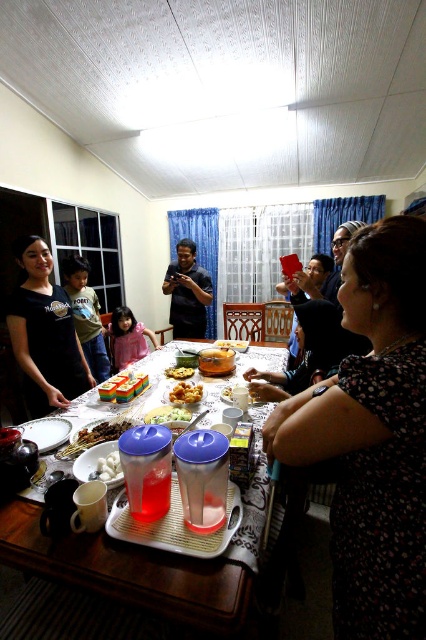
Does matte black shirt at left have a lesser width compared to matte black shirt at center?

Incorrect, matte black shirt at left's width is not less than matte black shirt at center's.

Who is shorter, matte black shirt at left or matte black shirt at center?

Standing shorter between the two is matte black shirt at center.

Is point (25, 260) more distant than point (181, 316)?

No, it is in front of (181, 316).

Where is `matte black shirt at left`? matte black shirt at left is located at coordinates (45, 333).

Which is below, white glossy platter at center or green leafy salad at center?

white glossy platter at center is lower down.

Measure the distance from white glossy platter at center to green leafy salad at center.

12.41 inches

Is point (37, 419) more distant than point (166, 416)?

Yes, it is.

This screenshot has width=426, height=640. In order to click on white glossy platter at center in this screenshot , I will do `click(46, 433)`.

Who is shorter, white glossy platter at center or white fluffy marshmallow at center?

white fluffy marshmallow at center is shorter.

You are a GUI agent. You are given a task and a screenshot of the screen. Output one action in this format:
    pyautogui.click(x=<x>, y=<y>)
    Task: Click on the white glossy platter at center
    Image resolution: width=426 pixels, height=640 pixels.
    Given the screenshot: What is the action you would take?
    pyautogui.click(x=46, y=433)